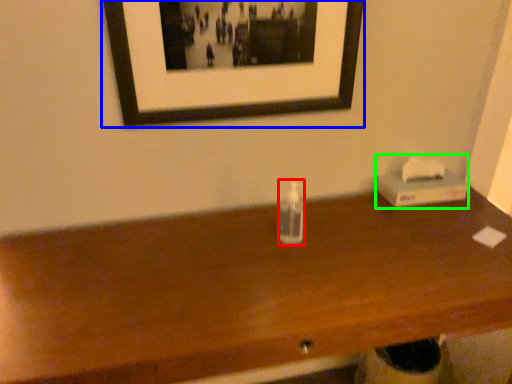
Question: Estimate the real-world distances between objects in this image. Which object is closer to bottle (highlighted by a red box), picture frame (highlighted by a blue box) or box (highlighted by a green box)?

Choices:
 (A) picture frame
 (B) box

Answer: (A)